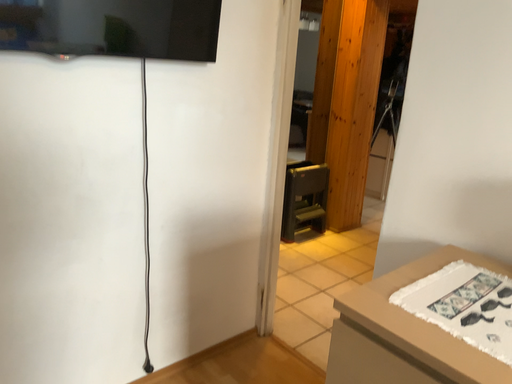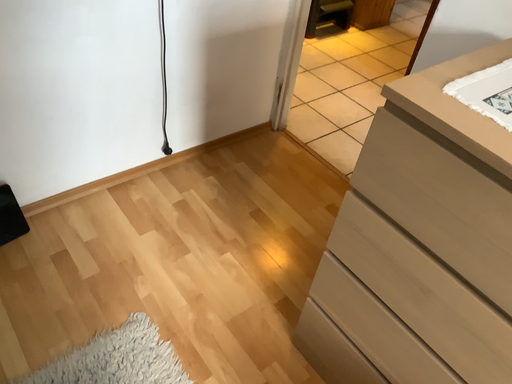
Question: How did the camera likely rotate when shooting the video?

Choices:
 (A) rotated upward
 (B) rotated downward

Answer: (B)